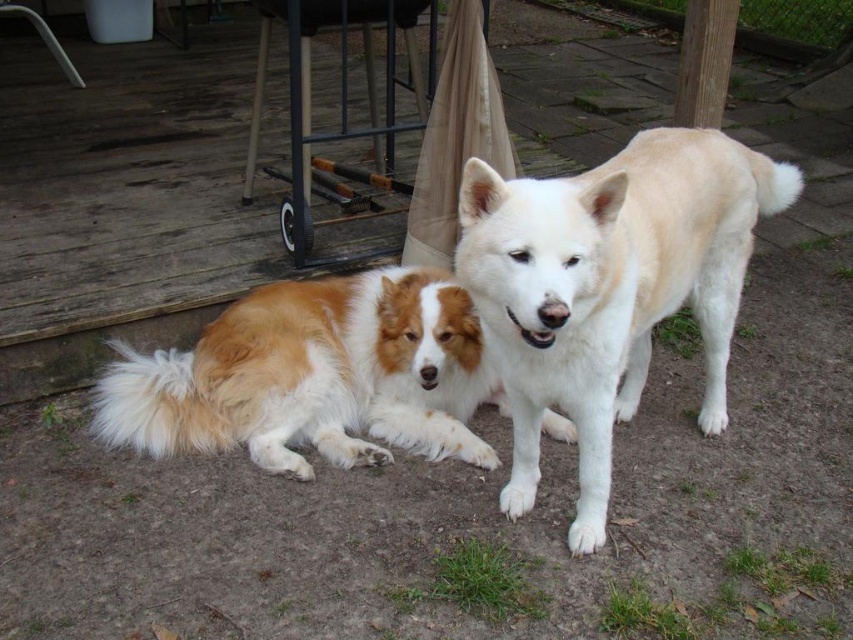
Question: Which point is farther to the camera?

Choices:
 (A) brown and white fur dog at center
 (B) white fur dog at center

Answer: (A)

Question: Is white fur dog at center bigger than brown and white fur dog at center?

Choices:
 (A) yes
 (B) no

Answer: (A)

Question: Does white fur dog at center appear over brown and white fur dog at center?

Choices:
 (A) yes
 (B) no

Answer: (A)

Question: Which point is closer to the camera taking this photo?

Choices:
 (A) (296, 438)
 (B) (485, 291)

Answer: (B)

Question: Does white fur dog at center appear over brown and white fur dog at center?

Choices:
 (A) no
 (B) yes

Answer: (B)